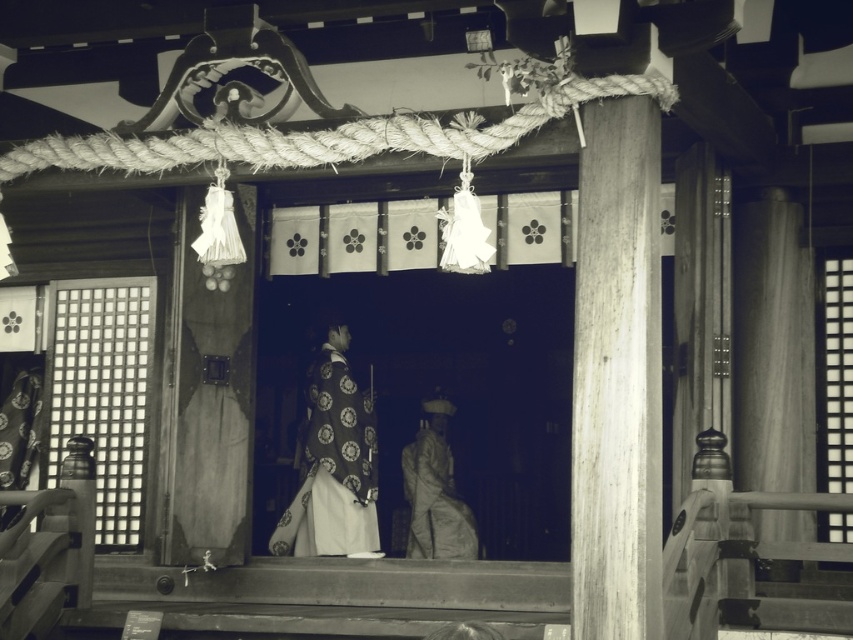
Question: Among these objects, which one is nearest to the camera?

Choices:
 (A) silky white kimono at center
 (B) silky gray robe at center

Answer: (A)

Question: Does silky white kimono at center come in front of silky gray robe at center?

Choices:
 (A) no
 (B) yes

Answer: (B)

Question: Is silky white kimono at center further to the viewer compared to silky gray robe at center?

Choices:
 (A) no
 (B) yes

Answer: (A)

Question: Can you confirm if silky white kimono at center is positioned to the right of silky gray robe at center?

Choices:
 (A) yes
 (B) no

Answer: (B)

Question: Which point is farther to the camera?

Choices:
 (A) (300, 531)
 (B) (450, 506)

Answer: (B)

Question: Which point is farther from the camera taking this photo?

Choices:
 (A) (432, 467)
 (B) (318, 515)

Answer: (A)